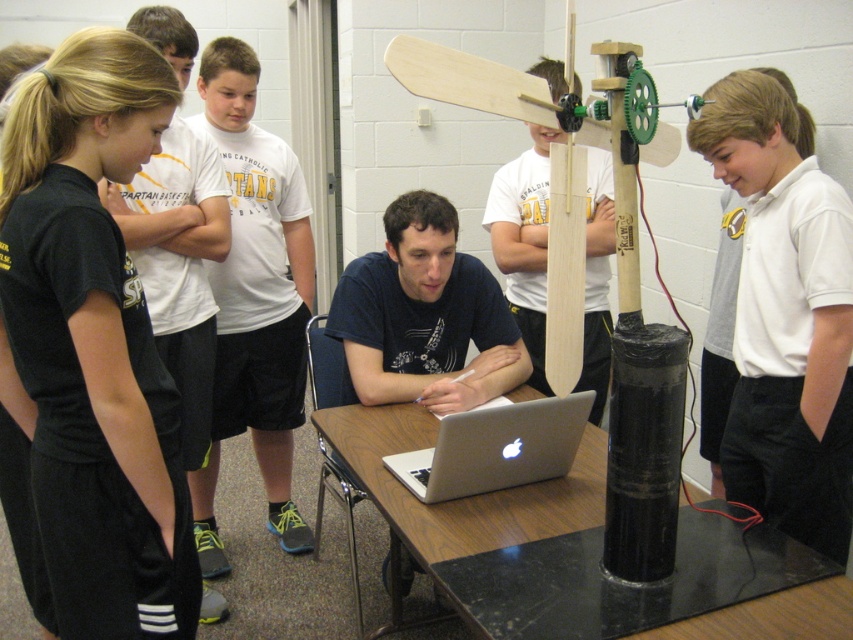
You are a photographer trying to capture a shot of the white smooth shirt at upper right and the black fabric at left. Which object is positioned to the left side of the other?

The black fabric at left is positioned to the left of white smooth shirt at upper right.

You are a student in the classroom and you want to place a small object on the black fabric at left. What are the coordinates where you should place it?

The coordinates for the black fabric at left are at point (91, 342), so you should place the object there.